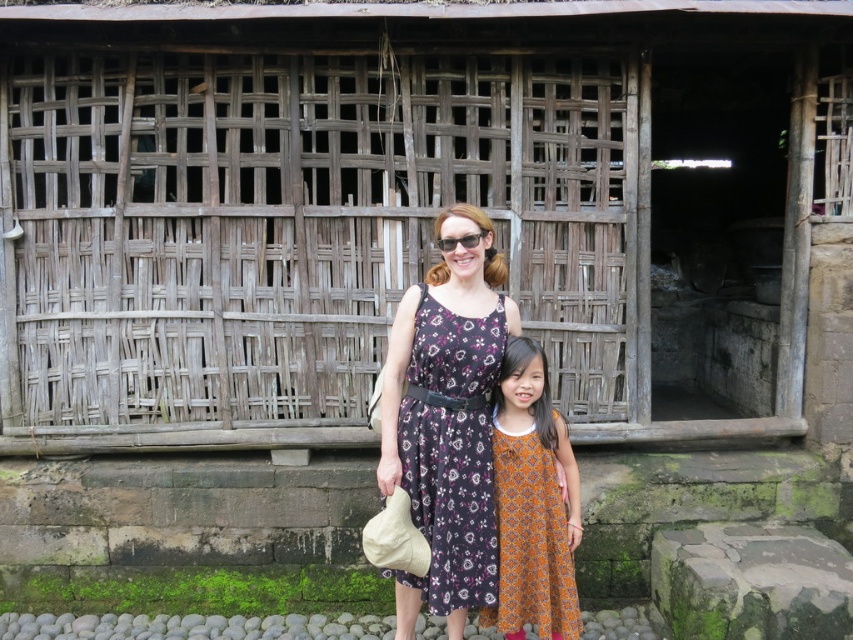
Looking at this image, who is positioned more to the right, floral-patterned fabric dress at center or orange printed dress at center?

Positioned to the right is orange printed dress at center.

Who is taller, floral-patterned fabric dress at center or orange printed dress at center?

Standing taller between the two is floral-patterned fabric dress at center.

Is point (471, 416) farther from camera compared to point (496, 508)?

No.

Image resolution: width=853 pixels, height=640 pixels. What are the coordinates of `floral-patterned fabric dress at center` in the screenshot? It's located at (451, 452).

What do you see at coordinates (532, 500) in the screenshot? I see `orange printed dress at center` at bounding box center [532, 500].

In order to click on orange printed dress at center in this screenshot , I will do `click(532, 500)`.

Describe the element at coordinates (451, 452) in the screenshot. This screenshot has height=640, width=853. I see `floral-patterned fabric dress at center` at that location.

Does point (415, 522) come farther from viewer compared to point (448, 244)?

No, it is not.

I want to click on floral-patterned fabric dress at center, so click(451, 452).

Where is `floral-patterned fabric dress at center`? The image size is (853, 640). floral-patterned fabric dress at center is located at coordinates (451, 452).